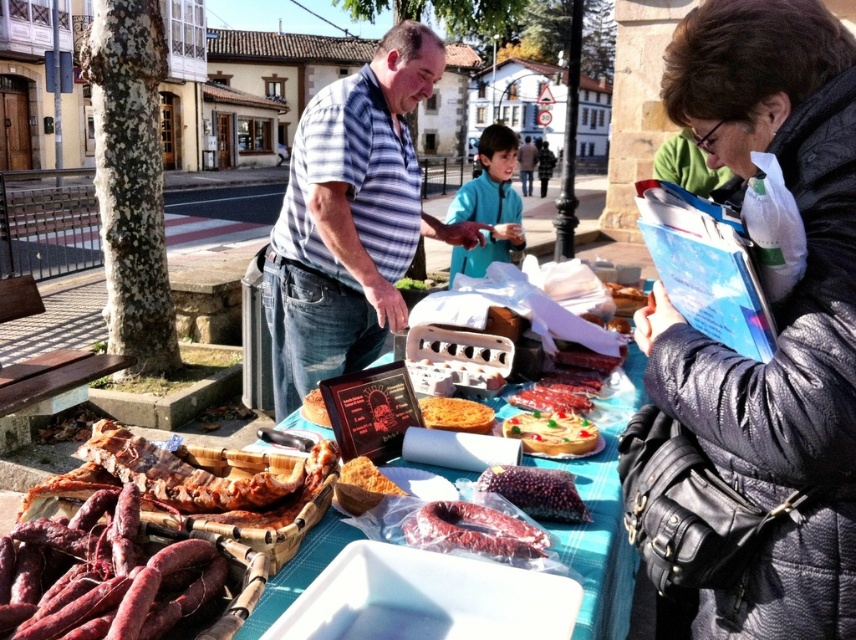
Question: Can you confirm if reddish-brown cured sausage at center is thinner than dark red textured sausage at center?

Choices:
 (A) no
 (B) yes

Answer: (A)

Question: In this image, where is reddish-brown cured sausage at center located relative to shiny plastic plate at center?

Choices:
 (A) left
 (B) right

Answer: (A)

Question: Among these objects, which one is nearest to the camera?

Choices:
 (A) matte plastic table at center
 (B) dark red textured sausage at center
 (C) dark red sausages at center
 (D) shiny plastic plate at center

Answer: (C)

Question: Which object is the farthest from the dark red textured sausage at center?

Choices:
 (A) dark red sausages at center
 (B) golden crispy bread at center
 (C) golden crispy pastry at center

Answer: (A)

Question: Which point is closer to the camera taking this photo?

Choices:
 (A) (13, 618)
 (B) (538, 387)

Answer: (A)

Question: Does striped cotton shirt at center appear under dark red textured sausage at center?

Choices:
 (A) no
 (B) yes

Answer: (A)